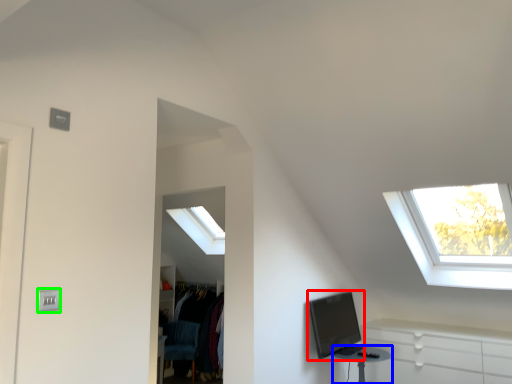
Question: Estimate the real-world distances between objects in this image. Which object is farther from computer monitor (highlighted by a red box), table (highlighted by a blue box) or electric outlet (highlighted by a green box)?

Choices:
 (A) table
 (B) electric outlet

Answer: (B)